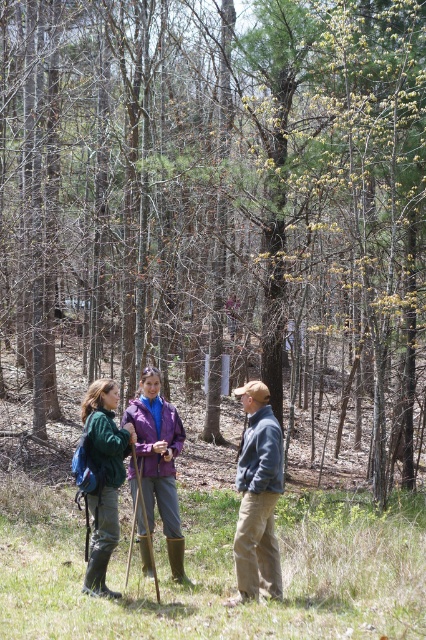
You are standing in the forest and see two points marked in the image. Which point is closer to you, point [155,456] or point [126,435]?

Point [155,456] is closer to you than point [126,435].

You are a photographer trying to capture a group photo of the three people in the forest scene. The camera you are using has a fixed focus point at coordinate 0.733 on the x axis and 0.371 on the y axis. Will the purple matte jacket at center be in focus in the photo?

Yes, the purple matte jacket at center is located exactly at the camera focus point coordinates of 0.733 on the x axis and 0.371 on the y axis, so it will be in focus.